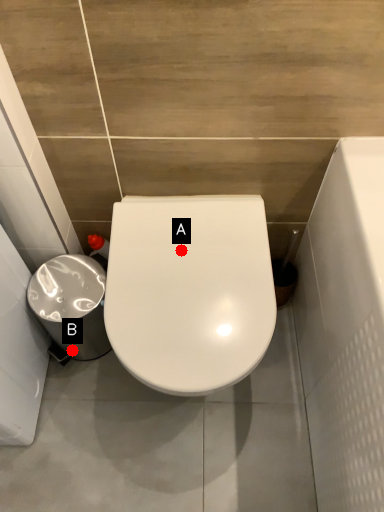
Question: Two points are circled on the image, labeled by A and B beside each circle. Which of the following is the closest to the observer?

Choices:
 (A) A is closer
 (B) B is closer

Answer: (A)